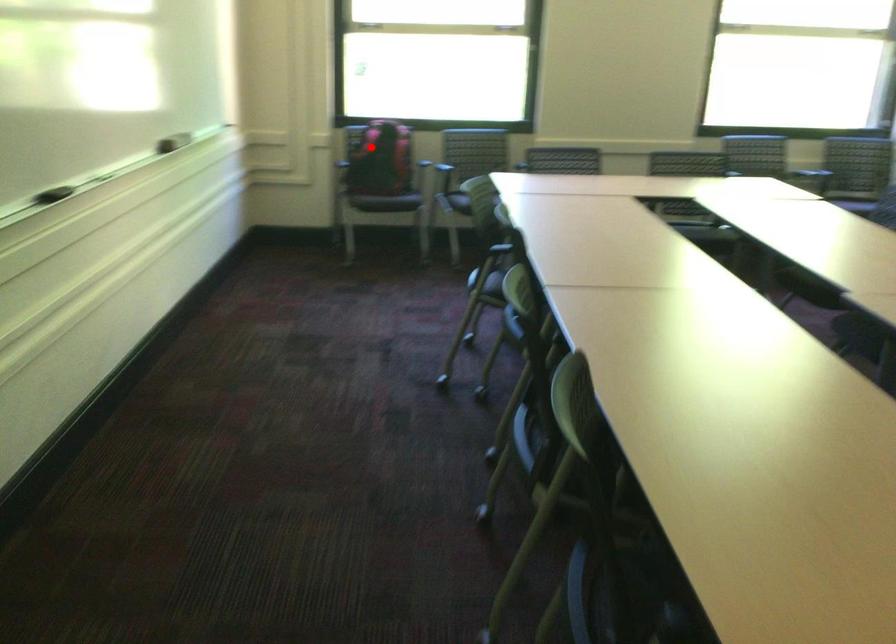
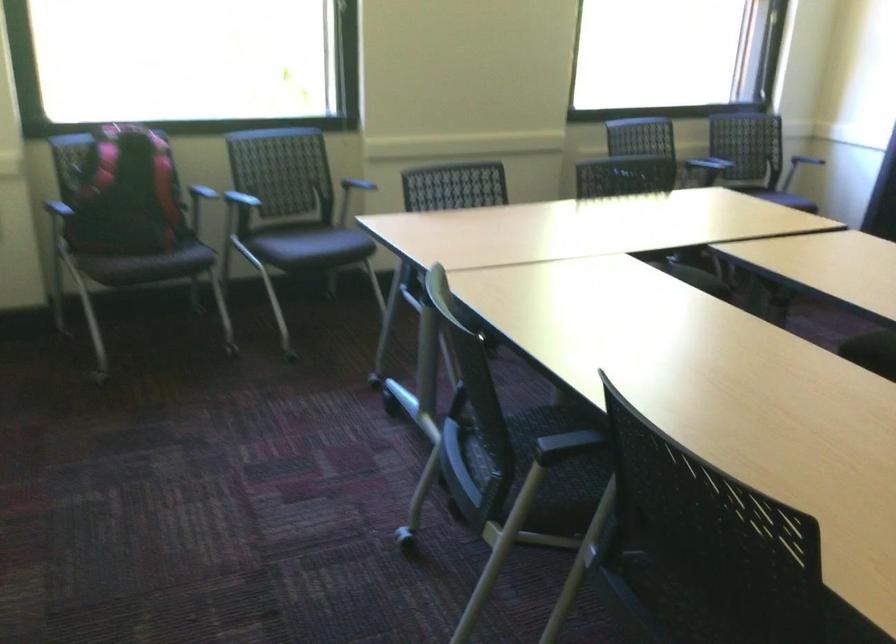
In the second image, find the point that corresponds to the highlighted location in the first image.

(125, 194)